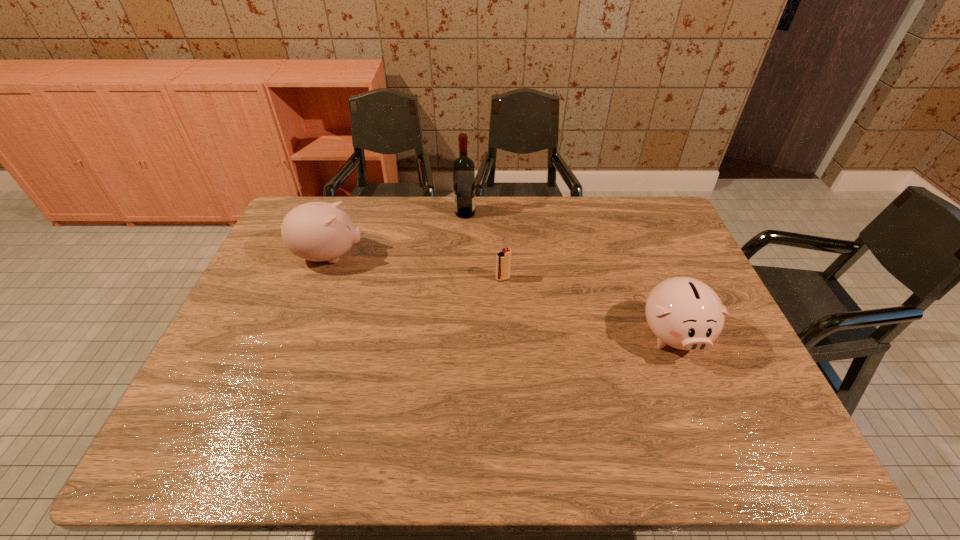
Identify the location of free spot that satisfies the following two spatial constraints: 1. on the front and back of the tallest object; 2. on the back side of the right piggy bank. (460, 333).

The width and height of the screenshot is (960, 540). What are the coordinates of `vacant space that satisfies the following two spatial constraints: 1. at the snout of the second object from right to left; 2. on the right side of the left piggy bank` in the screenshot? It's located at (322, 279).

Identify the location of free spot that satisfies the following two spatial constraints: 1. on the front and back of the second object from left to right; 2. on the right side of the igniter. (463, 279).

This screenshot has width=960, height=540. Find the location of `free region that satisfies the following two spatial constraints: 1. on the front side of the nearer piggy bank; 2. on the left side of the igniter`. free region that satisfies the following two spatial constraints: 1. on the front side of the nearer piggy bank; 2. on the left side of the igniter is located at coordinates (506, 333).

Image resolution: width=960 pixels, height=540 pixels. Find the location of `vacant space that satisfies the following two spatial constraints: 1. on the front and back of the tallest object; 2. on the back side of the right piggy bank`. vacant space that satisfies the following two spatial constraints: 1. on the front and back of the tallest object; 2. on the back side of the right piggy bank is located at coordinates (460, 333).

Identify the location of free space that satisfies the following two spatial constraints: 1. on the front and back of the igniter; 2. on the left side of the farthest object. This screenshot has height=540, width=960. (463, 279).